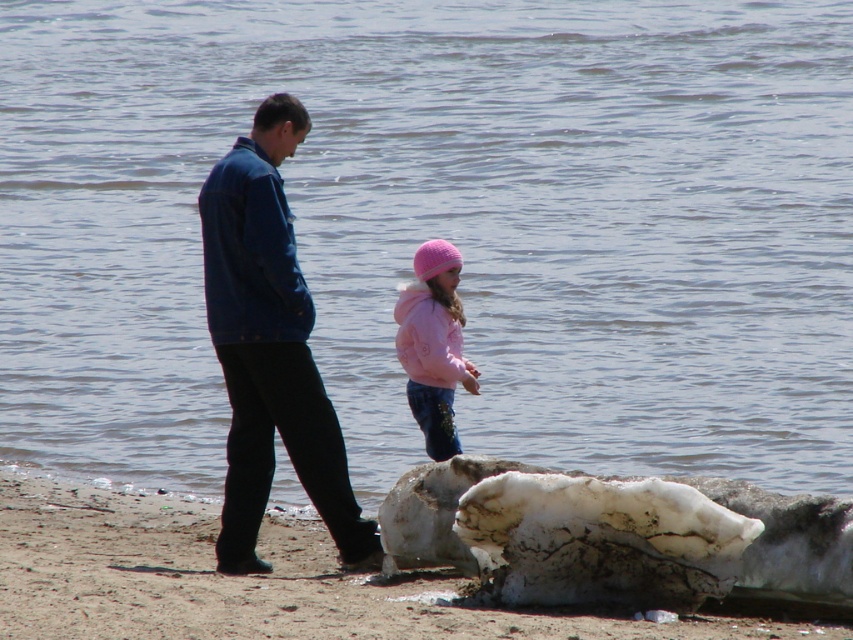
What do you see at coordinates (270, 348) in the screenshot? I see `blue denim jacket at center` at bounding box center [270, 348].

Does point (231, 252) come in front of point (434, 451)?

Yes.

The width and height of the screenshot is (853, 640). I want to click on blue denim jacket at center, so click(270, 348).

Does smooth sand at lower left have a smaller size compared to pink fleece jacket at center?

Yes, smooth sand at lower left is smaller than pink fleece jacket at center.

Between smooth sand at lower left and pink fleece jacket at center, which one has more height?

pink fleece jacket at center

Between point (80, 563) and point (459, 308), which one is positioned behind?

Positioned behind is point (459, 308).

Locate an element on the screen. smooth sand at lower left is located at coordinates (248, 580).

Is the position of smooth sand at lower left more distant than that of blue denim jacket at center?

No, it is in front of blue denim jacket at center.

Is smooth sand at lower left below blue denim jacket at center?

Yes, smooth sand at lower left is below blue denim jacket at center.

Who is more forward, [39,541] or [276,419]?

Point [276,419] is in front.

Locate an element on the screen. The width and height of the screenshot is (853, 640). smooth sand at lower left is located at coordinates (248, 580).